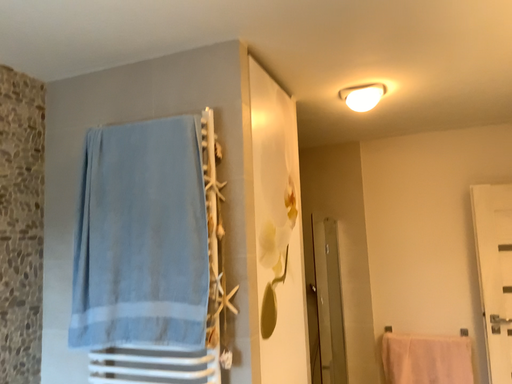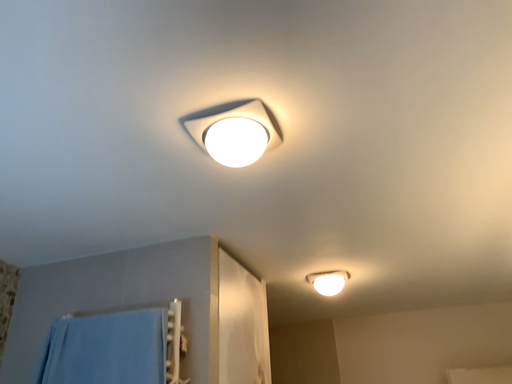
Question: Which way did the camera rotate in the video?

Choices:
 (A) rotated upward
 (B) rotated downward

Answer: (A)